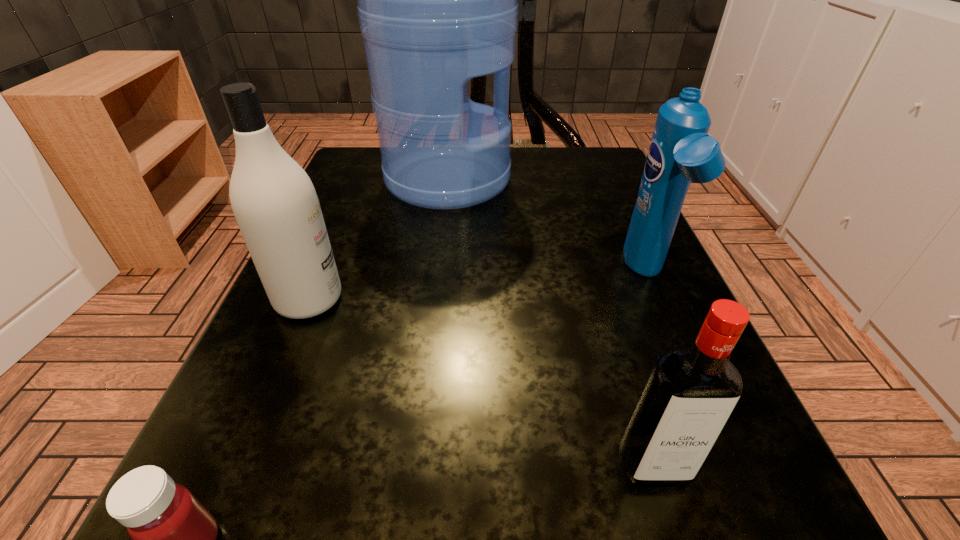
This screenshot has width=960, height=540. What are the coordinates of `vacant space that satisfies the following two spatial constraints: 1. on the side of the right shampoo with the handle; 2. on the right side of the third object from left to right` in the screenshot? It's located at (437, 274).

What are the coordinates of `free space in the image that satisfies the following two spatial constraints: 1. on the side of the farthest object with the handle; 2. on the back side of the right shampoo` in the screenshot? It's located at (437, 274).